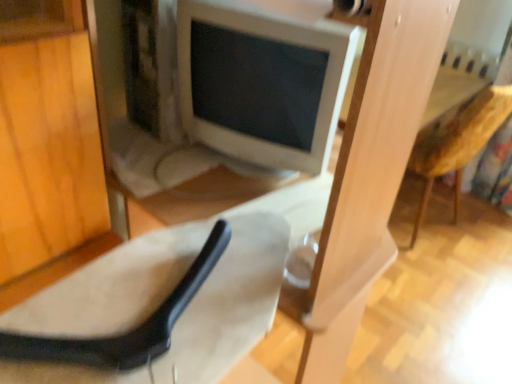
Question: From a real-world perspective, does wooden textured armchair at right sit lower than white glossy computer monitor at center?

Choices:
 (A) yes
 (B) no

Answer: (A)

Question: From the image's perspective, does wooden textured armchair at right appear higher than white glossy computer monitor at center?

Choices:
 (A) yes
 (B) no

Answer: (B)

Question: Can you confirm if wooden textured armchair at right is thinner than white glossy computer monitor at center?

Choices:
 (A) yes
 (B) no

Answer: (B)

Question: Considering the relative positions of wooden textured armchair at right and white glossy computer monitor at center in the image provided, is wooden textured armchair at right to the left of white glossy computer monitor at center from the viewer's perspective?

Choices:
 (A) no
 (B) yes

Answer: (A)

Question: Is white glossy computer monitor at center inside wooden textured armchair at right?

Choices:
 (A) no
 (B) yes

Answer: (A)

Question: Is white glossy computer monitor at center situated inside suede-like beige chair at lower left or outside?

Choices:
 (A) inside
 (B) outside

Answer: (B)

Question: In the image, is white glossy computer monitor at center positioned in front of or behind suede-like beige chair at lower left?

Choices:
 (A) behind
 (B) front

Answer: (A)

Question: In terms of height, does white glossy computer monitor at center look taller or shorter compared to suede-like beige chair at lower left?

Choices:
 (A) tall
 (B) short

Answer: (A)

Question: Does point (311, 28) appear closer or farther from the camera than point (246, 249)?

Choices:
 (A) closer
 (B) farther

Answer: (B)

Question: From a real-world perspective, relative to white glossy computer monitor at center, is wooden textured armchair at right vertically above or below?

Choices:
 (A) below
 (B) above

Answer: (A)

Question: Is wooden textured armchair at right bigger or smaller than white glossy computer monitor at center?

Choices:
 (A) small
 (B) big

Answer: (B)

Question: Is wooden textured armchair at right in front of or behind white glossy computer monitor at center in the image?

Choices:
 (A) behind
 (B) front

Answer: (A)

Question: In terms of width, does wooden textured armchair at right look wider or thinner when compared to white glossy computer monitor at center?

Choices:
 (A) wide
 (B) thin

Answer: (A)

Question: Considering the positions of wooden textured armchair at right and suede-like beige chair at lower left in the image, is wooden textured armchair at right bigger or smaller than suede-like beige chair at lower left?

Choices:
 (A) big
 (B) small

Answer: (A)

Question: Do you think wooden textured armchair at right is within suede-like beige chair at lower left, or outside of it?

Choices:
 (A) inside
 (B) outside

Answer: (B)